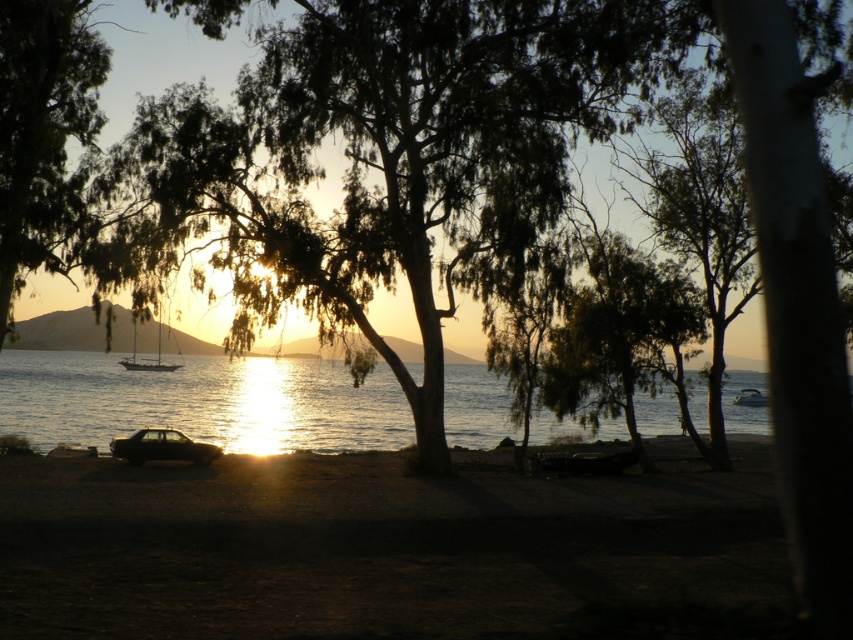
Question: Is shiny metallic car at center to the left of white glossy boat at lower right from the viewer's perspective?

Choices:
 (A) yes
 (B) no

Answer: (A)

Question: Which object is the closest to the white glossy boat at lower right?

Choices:
 (A) green leafy tree at center
 (B) dark sand at lower center
 (C) shiny silver sailboat at center
 (D) shiny metallic car at center

Answer: (A)

Question: Which point is farther to the camera?

Choices:
 (A) (138, 406)
 (B) (351, 161)

Answer: (A)

Question: Is dark sand at lower center to the left of white glossy boat at lower right from the viewer's perspective?

Choices:
 (A) no
 (B) yes

Answer: (B)

Question: Which of the following is the farthest from the observer?

Choices:
 (A) (x=177, y=444)
 (B) (x=749, y=403)
 (C) (x=505, y=404)
 (D) (x=163, y=552)

Answer: (C)

Question: Does glistening water at center have a lesser width compared to shiny silver sailboat at center?

Choices:
 (A) no
 (B) yes

Answer: (A)